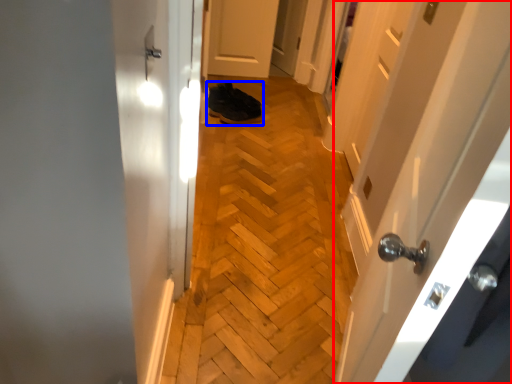
Question: Which object appears farthest to the camera in this image, door (highlighted by a red box) or footwear (highlighted by a blue box)?

Choices:
 (A) door
 (B) footwear

Answer: (B)